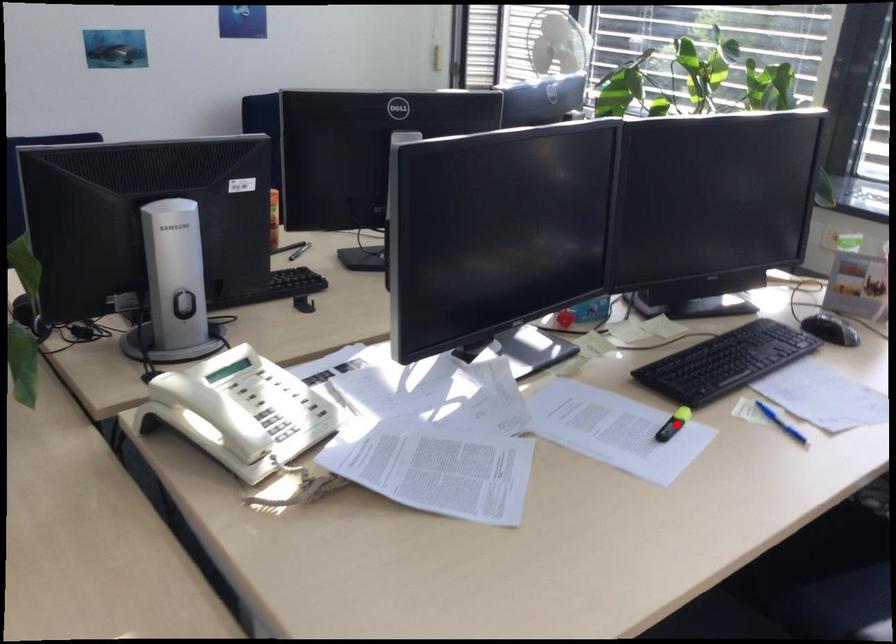
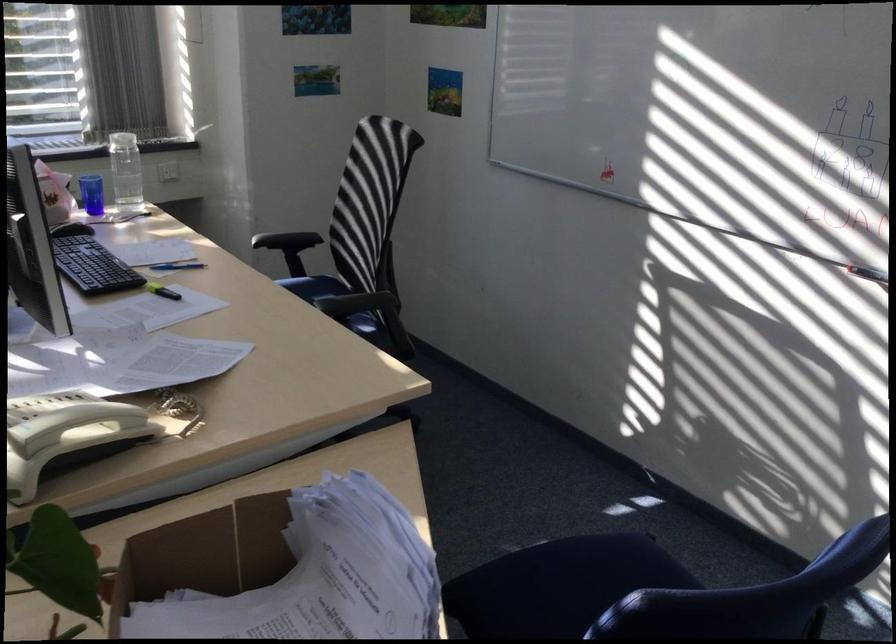
Where in the second image is the point corresponding to the highlighted location from the first image?

(161, 290)